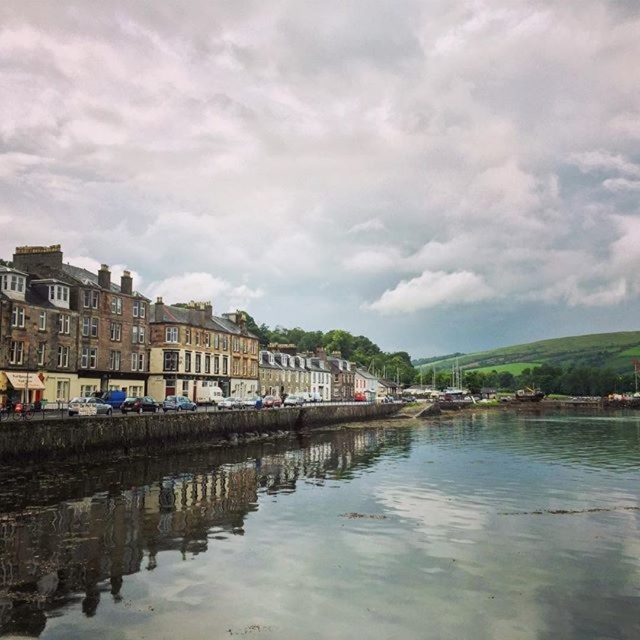
Is matte stone buildings at center wider than silver metallic car at center?

Correct, the width of matte stone buildings at center exceeds that of silver metallic car at center.

Does matte stone buildings at center have a larger size compared to silver metallic car at center?

Yes, matte stone buildings at center is bigger than silver metallic car at center.

This screenshot has height=640, width=640. What do you see at coordinates (163, 342) in the screenshot?
I see `matte stone buildings at center` at bounding box center [163, 342].

Identify the location of matte stone buildings at center. This screenshot has width=640, height=640. (163, 342).

Is clear water at center below matte stone buildings at center?

Correct, clear water at center is located below matte stone buildings at center.

Does clear water at center lie in front of matte stone buildings at center?

Yes, clear water at center is closer to the viewer.

What do you see at coordinates (346, 540) in the screenshot? This screenshot has width=640, height=640. I see `clear water at center` at bounding box center [346, 540].

Locate an element on the screen. The width and height of the screenshot is (640, 640). clear water at center is located at coordinates (346, 540).

Between clear water at center and silver metallic car at center, which one appears on the right side from the viewer's perspective?

From the viewer's perspective, clear water at center appears more on the right side.

Does clear water at center have a smaller size compared to silver metallic car at center?

Incorrect, clear water at center is not smaller in size than silver metallic car at center.

This screenshot has height=640, width=640. In order to click on clear water at center in this screenshot , I will do `click(346, 540)`.